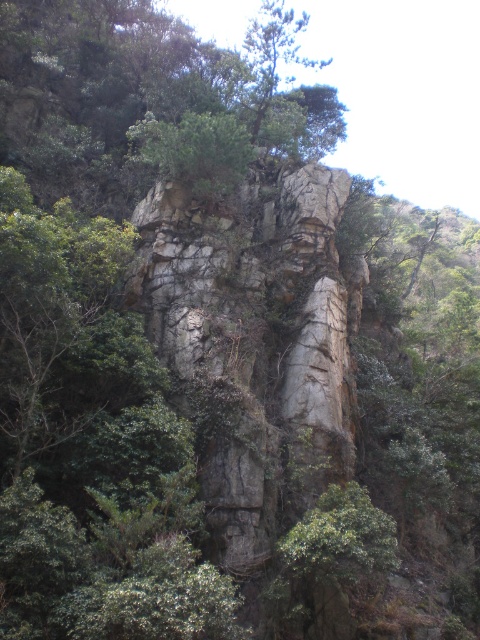
Is rocky cliff at center above green leafy tree at upper center?

Actually, rocky cliff at center is below green leafy tree at upper center.

Is rocky cliff at center shorter than green leafy tree at upper center?

Yes, rocky cliff at center is shorter than green leafy tree at upper center.

Which is behind, point (224, 378) or point (278, 4)?

Positioned behind is point (278, 4).

Find the location of `rocky cliff at center`. rocky cliff at center is located at coordinates (255, 340).